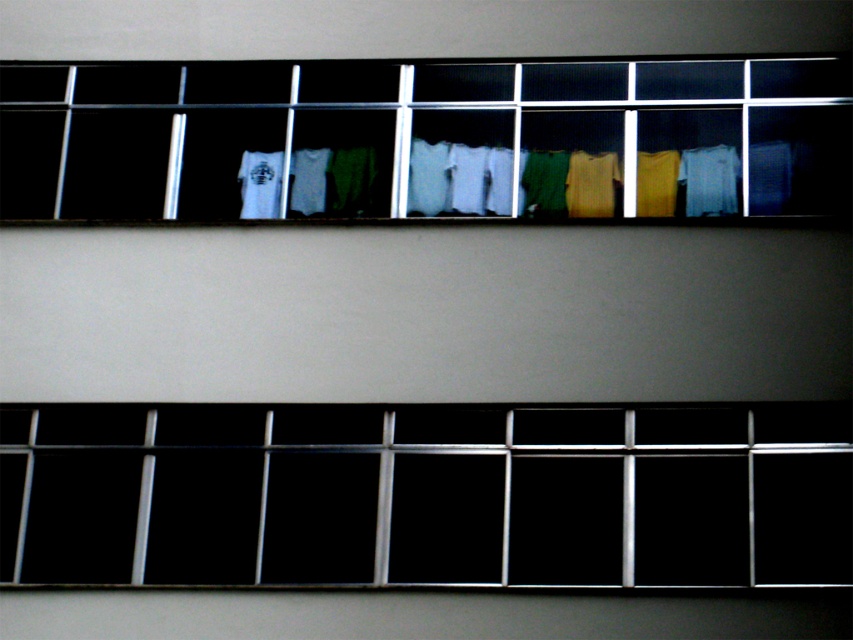
Is white cotton shirt at right taller than matte yellow sweater at center?

Correct, white cotton shirt at right is much taller as matte yellow sweater at center.

Between white cotton shirt at right and matte yellow sweater at center, which one appears on the left side from the viewer's perspective?

From the viewer's perspective, matte yellow sweater at center appears more on the left side.

Is point (722, 145) farther from camera compared to point (636, 188)?

That is True.

This screenshot has height=640, width=853. In order to click on white cotton shirt at right in this screenshot , I will do `click(709, 180)`.

Which is behind, point (701, 570) or point (693, 186)?

The point (693, 186) is more distant.

Describe the element at coordinates (425, 496) in the screenshot. The height and width of the screenshot is (640, 853). I see `transparent glass at center` at that location.

Measure the distance between transparent glass at center and camera.

The distance of transparent glass at center from camera is 19.03 meters.

This screenshot has width=853, height=640. Identify the location of transparent glass at center. [425, 496].

Can you confirm if white fabric at center is shorter than matte yellow sweater at center?

No, white fabric at center is not shorter than matte yellow sweater at center.

Where is `white fabric at center`? The image size is (853, 640). white fabric at center is located at coordinates (410, 138).

Where is `white fabric at center`? white fabric at center is located at coordinates (410, 138).